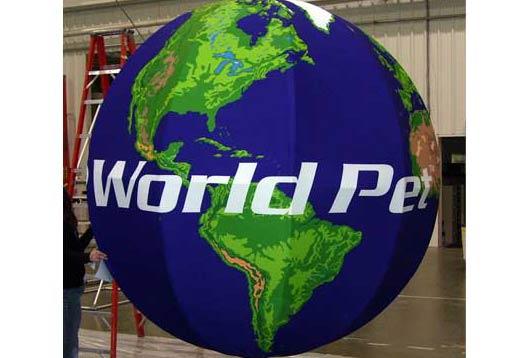
Locate an element on the screen. top of ladder is located at coordinates (109, 30).